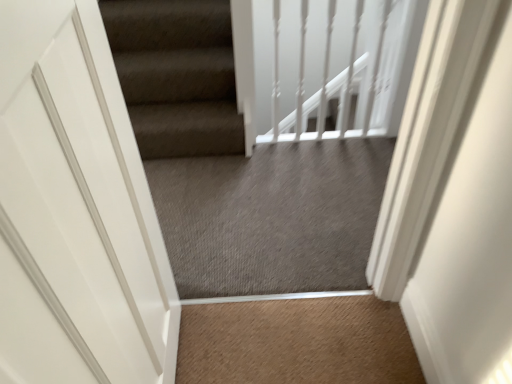
Question: Is white glossy balustrade at upper center facing towards white matte door at left?

Choices:
 (A) no
 (B) yes

Answer: (B)

Question: Does white glossy balustrade at upper center come in front of white matte door at left?

Choices:
 (A) no
 (B) yes

Answer: (A)

Question: Is white glossy balustrade at upper center outside white matte door at left?

Choices:
 (A) no
 (B) yes

Answer: (B)

Question: Is white glossy balustrade at upper center bigger than white matte door at left?

Choices:
 (A) no
 (B) yes

Answer: (A)

Question: Does white glossy balustrade at upper center have a smaller size compared to white matte door at left?

Choices:
 (A) yes
 (B) no

Answer: (A)

Question: Is point coord(311,72) positioned closer to the camera than point coord(290,266)?

Choices:
 (A) farther
 (B) closer

Answer: (A)

Question: Looking at the image, does white glossy balustrade at upper center seem bigger or smaller compared to gray carpet at center?

Choices:
 (A) small
 (B) big

Answer: (A)

Question: Considering the positions of white glossy balustrade at upper center and gray carpet at center in the image, is white glossy balustrade at upper center taller or shorter than gray carpet at center?

Choices:
 (A) tall
 (B) short

Answer: (B)

Question: Choose the correct answer: Is white glossy balustrade at upper center inside gray carpet at center or outside it?

Choices:
 (A) outside
 (B) inside

Answer: (A)

Question: Is white glossy balustrade at upper center inside the boundaries of white matte door at left, or outside?

Choices:
 (A) outside
 (B) inside

Answer: (A)

Question: In terms of height, does white glossy balustrade at upper center look taller or shorter compared to white matte door at left?

Choices:
 (A) short
 (B) tall

Answer: (A)

Question: Is white glossy balustrade at upper center to the left or to the right of white matte door at left in the image?

Choices:
 (A) right
 (B) left

Answer: (A)

Question: Is white glossy balustrade at upper center wider or thinner than white matte door at left?

Choices:
 (A) wide
 (B) thin

Answer: (B)

Question: Is gray carpet at center situated inside white glossy balustrade at upper center or outside?

Choices:
 (A) inside
 (B) outside

Answer: (B)

Question: Visually, is gray carpet at center positioned to the left or to the right of white glossy balustrade at upper center?

Choices:
 (A) right
 (B) left

Answer: (B)